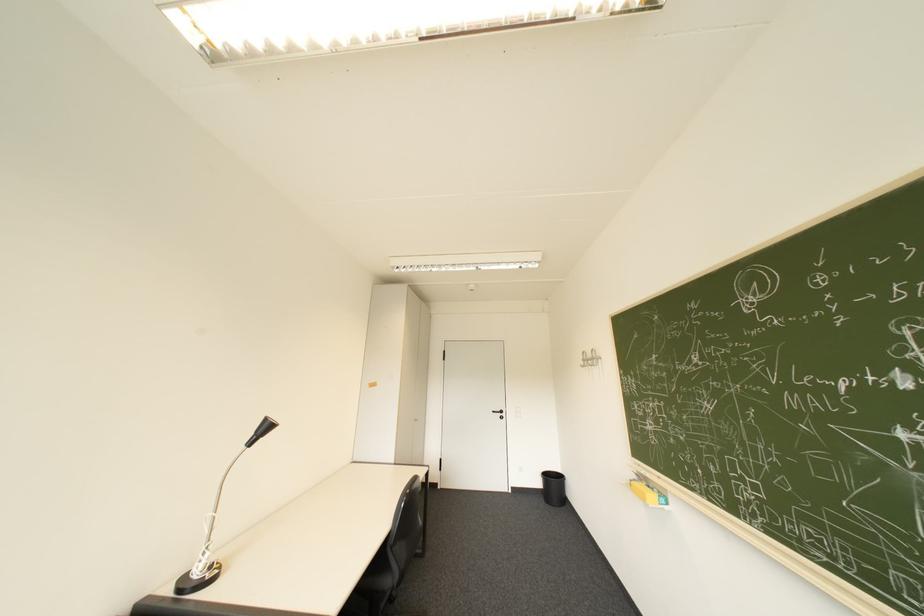
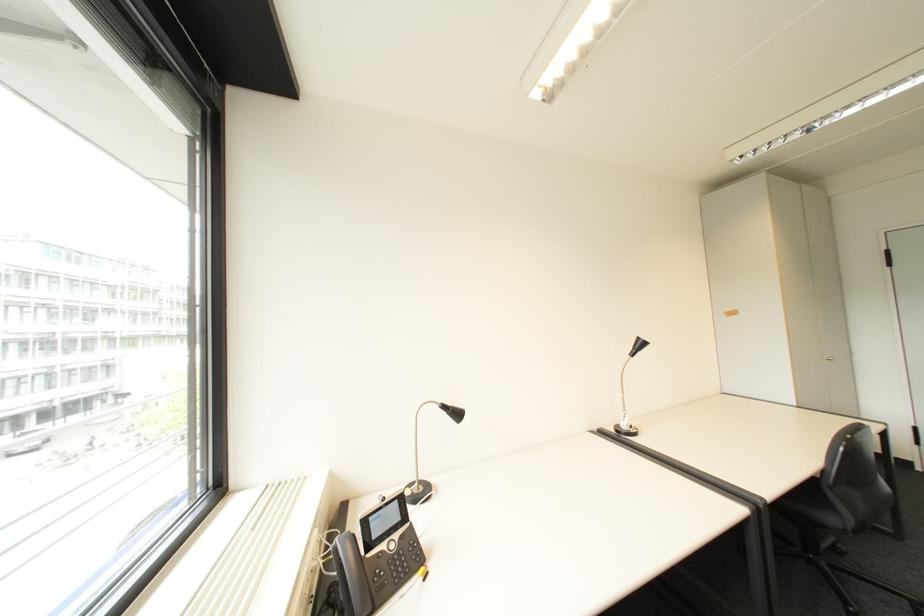
Question: The camera is either moving clockwise (left) or counter-clockwise (right) around the object. The first image is from the beginning of the video and the second image is from the end. Is the camera moving left or right when shooting the video?

Choices:
 (A) Left
 (B) Right

Answer: (B)